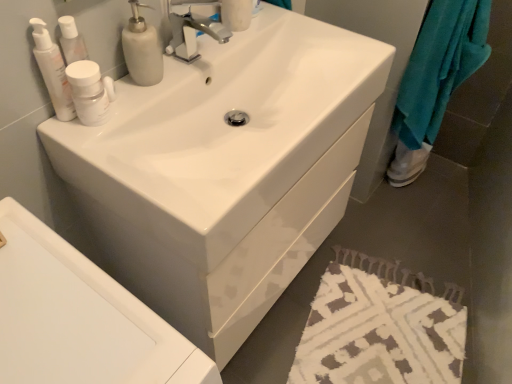
This screenshot has height=384, width=512. I want to click on free space underneath white textured bath mat at lower right (from a real-world perspective), so click(383, 321).